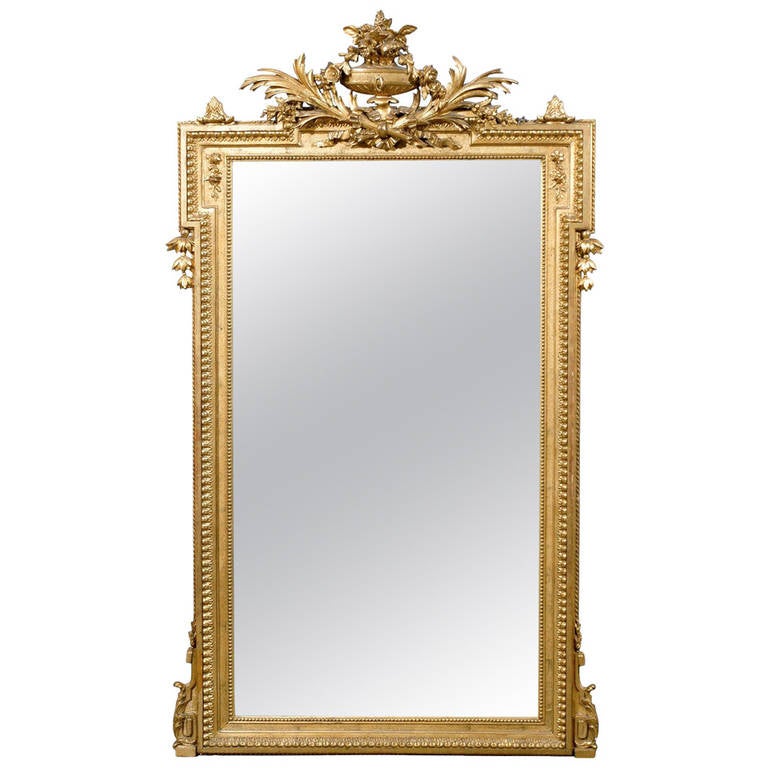
The image size is (768, 768). In order to click on decorative edges to mirror on bottom in this screenshot , I will do `click(588, 750)`, `click(186, 737)`.